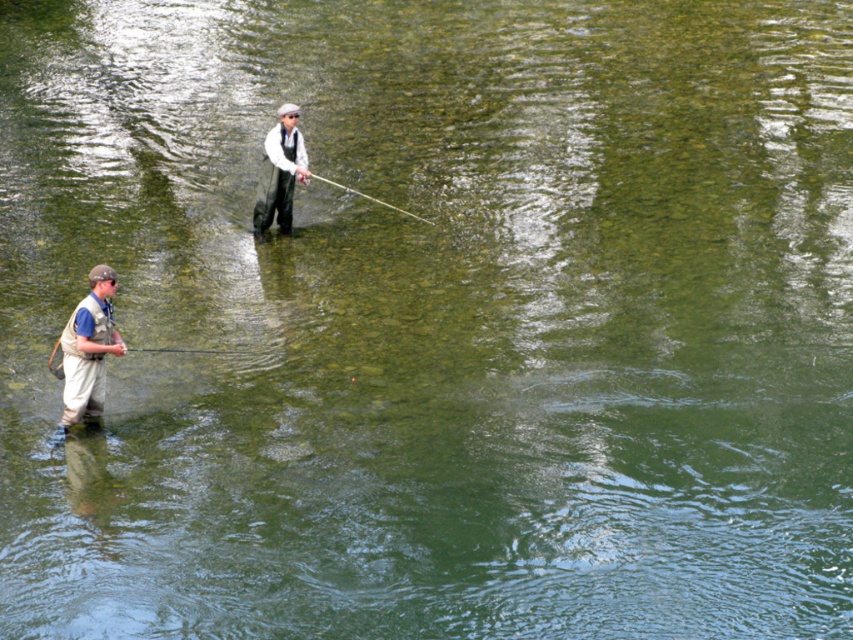
Which of these two, light brown fabric vest at lower left or smooth rod at center, stands taller?

With more height is light brown fabric vest at lower left.

Looking at this image, between light brown fabric vest at lower left and smooth rod at center, which one is positioned higher?

Positioned higher is smooth rod at center.

Who is more distant from viewer, (x=91, y=353) or (x=368, y=198)?

Point (x=368, y=198)

Where is `light brown fabric vest at lower left`? light brown fabric vest at lower left is located at coordinates (90, 348).

Is point (292, 154) positioned behind point (397, 209)?

No.

Who is positioned more to the left, white cotton shirt at center or smooth rod at center?

white cotton shirt at center

At what (x,y) coordinates should I click in order to perform the action: click on white cotton shirt at center. Please return your answer as a coordinate pair (x, y). Looking at the image, I should click on (279, 172).

Between light brown fabric vest at lower left and white cotton shirt at center, which one appears on the left side from the viewer's perspective?

light brown fabric vest at lower left

Between light brown fabric vest at lower left and white cotton shirt at center, which one has less height?

With less height is light brown fabric vest at lower left.

Is point (97, 394) positioned after point (308, 180)?

No, (97, 394) is in front of (308, 180).

Locate an element on the screen. light brown fabric vest at lower left is located at coordinates (90, 348).